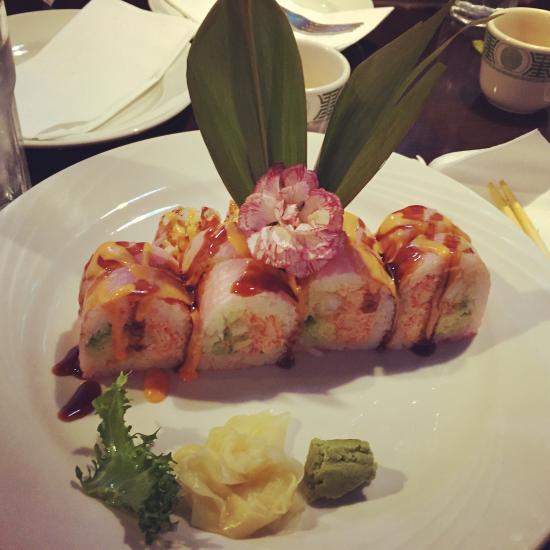
Where is `napkin`? napkin is located at coordinates (123, 89), (371, 16).